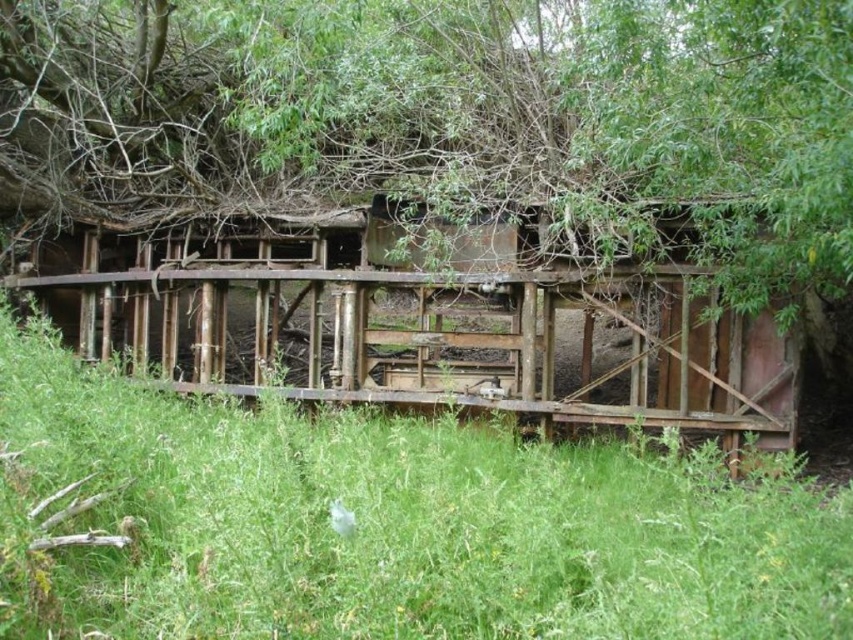
You are a hiker carrying a 5.5 feet long backpack. You spot a green leafy tree at upper center and a rusty wood hut at center. Can you pass through the space between them with your backpack?

The distance between the green leafy tree at upper center and the rusty wood hut at center is 4.90 feet. Since your backpack is 5.5 feet long, it is longer than the available space. Therefore, you cannot pass through the space between them with your backpack.

You are a hiker trying to determine if the green leafy tree at upper center can provide shade over the rusty wood hut at center. Based on their widths, will the tree be wide enough to cover the hut?

The green leafy tree at upper center has a width less than the rusty wood hut at center, so it cannot provide enough shade to fully cover the hut.